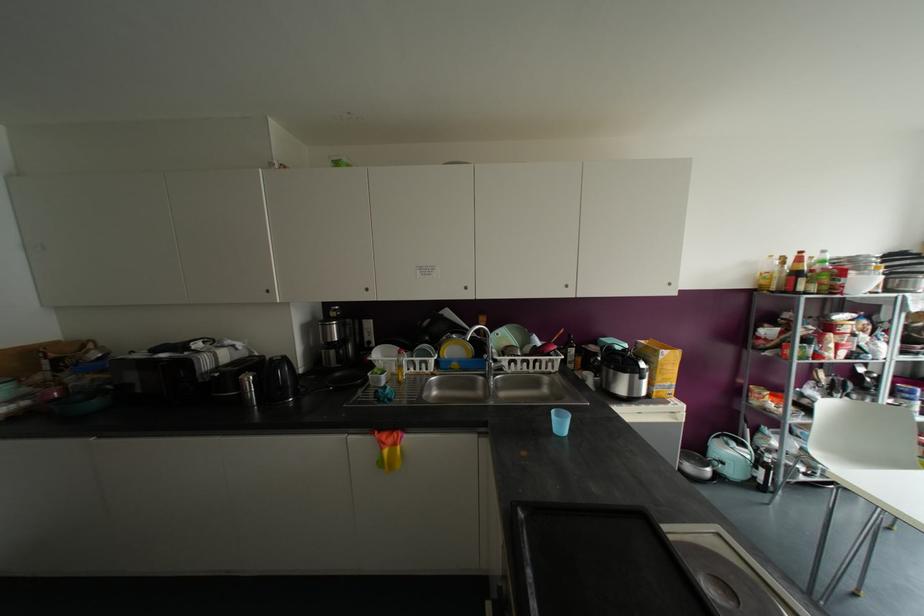
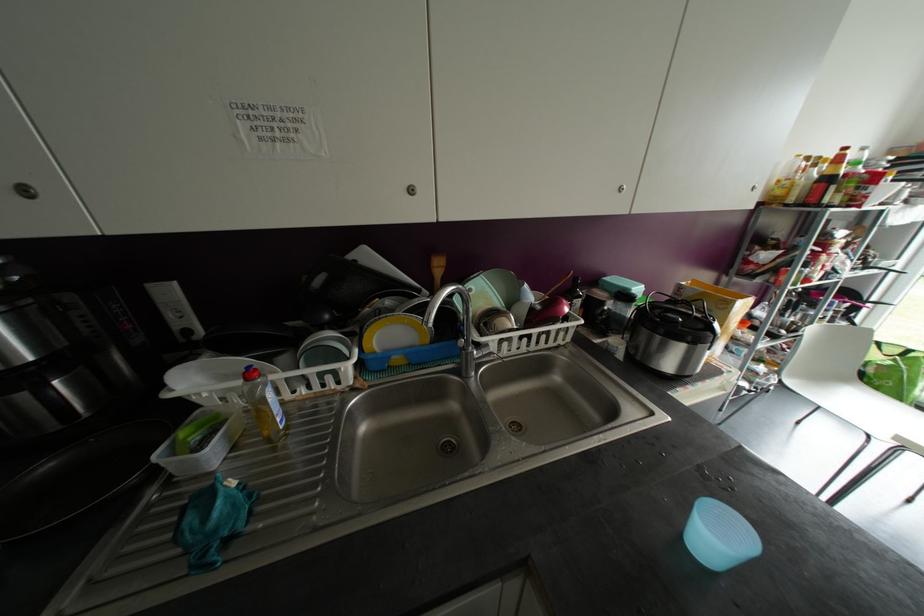
Question: The images are taken continuously from a first-person perspective. In which direction are you moving?

Choices:
 (A) Left
 (B) Right
 (C) Forward
 (D) Backward

Answer: (C)